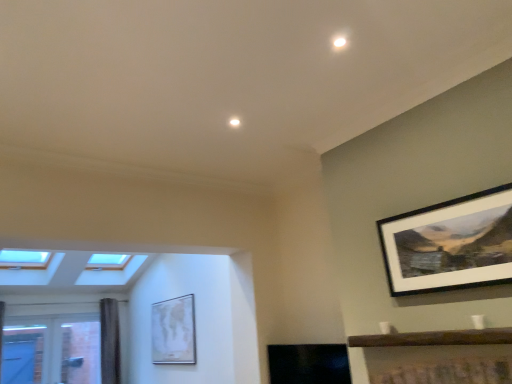
Question: Should I look upward or downward to see matte white map at center, acting as the second picture frame starting from the front?

Choices:
 (A) down
 (B) up

Answer: (A)

Question: Is clear glass window at lower left smaller than matte white map at center, marked as the 2th picture frame in a right-to-left arrangement?

Choices:
 (A) yes
 (B) no

Answer: (B)

Question: From a real-world perspective, is clear glass window at lower left positioned over matte white map at center, positioned as the first picture frame in left-to-right order, based on gravity?

Choices:
 (A) yes
 (B) no

Answer: (B)

Question: Is clear glass window at lower left next to matte white map at center, placed as the first picture frame when sorted from bottom to top?

Choices:
 (A) yes
 (B) no

Answer: (B)

Question: Is clear glass window at lower left wider than matte white map at center, marked as the 2th picture frame in a right-to-left arrangement?

Choices:
 (A) yes
 (B) no

Answer: (A)

Question: Considering the relative sizes of clear glass window at lower left and matte white map at center, placed as the 1th picture frame when sorted from back to front, in the image provided, is clear glass window at lower left bigger than matte white map at center, placed as the 1th picture frame when sorted from back to front,?

Choices:
 (A) yes
 (B) no

Answer: (A)

Question: Can matte white map at center, acting as the second picture frame starting from the front, be found inside clear glass window at lower left?

Choices:
 (A) no
 (B) yes

Answer: (A)

Question: Is wooden shelf at lower right next to clear glass window at lower left and touching it?

Choices:
 (A) no
 (B) yes

Answer: (A)

Question: Is wooden shelf at lower right facing towards clear glass window at lower left?

Choices:
 (A) yes
 (B) no

Answer: (B)

Question: Is wooden shelf at lower right wider than clear glass window at lower left?

Choices:
 (A) yes
 (B) no

Answer: (A)

Question: Would you say wooden shelf at lower right contains clear glass window at lower left?

Choices:
 (A) yes
 (B) no

Answer: (B)

Question: Is wooden shelf at lower right closer to the viewer compared to clear glass window at lower left?

Choices:
 (A) no
 (B) yes

Answer: (B)

Question: Is wooden shelf at lower right shorter than clear glass window at lower left?

Choices:
 (A) yes
 (B) no

Answer: (A)

Question: Is wooden shelf at lower right at the right side of matte white map at center, placed as the 1th picture frame when sorted from back to front?

Choices:
 (A) no
 (B) yes

Answer: (B)